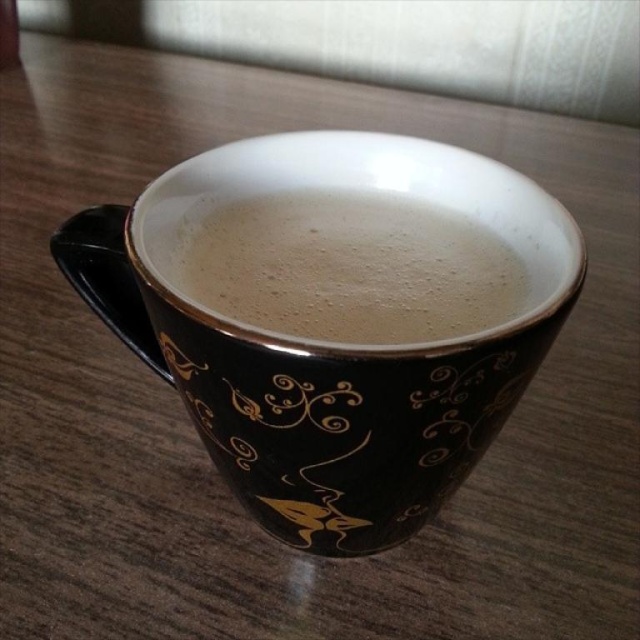
You are a barista preparing a drink and need to ensure the white frothy coffee at center fits inside the black ceramic mug at center. Based on the scene, will the foam overflow when poured into the mug?

The black ceramic mug at center has a larger size compared to white frothy coffee at center, so the foam will not overflow when poured into the mug.

You are trying to pour more coffee into the black ceramic mug at center. However, you notice the white frothy coffee at center is already occupying the space. Can you pour more into the mug without spilling?

The black ceramic mug at center is in front of the white frothy coffee at center, meaning the frothy coffee is inside the mug. Therefore, you can pour more into the mug as long as there is enough space left inside.

Looking at this image, you are a barista trying to determine if the white frothy coffee at center can fit into the black ceramic mug at center without spilling. Based on their sizes, what do you think?

The black ceramic mug at center is much taller than the white frothy coffee at center, so there should be enough space to pour the coffee without spilling.